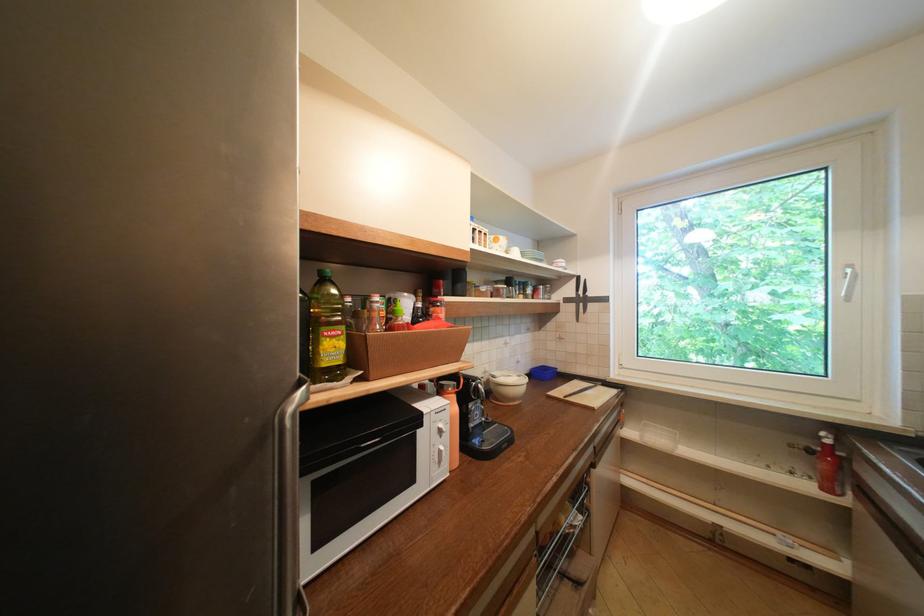
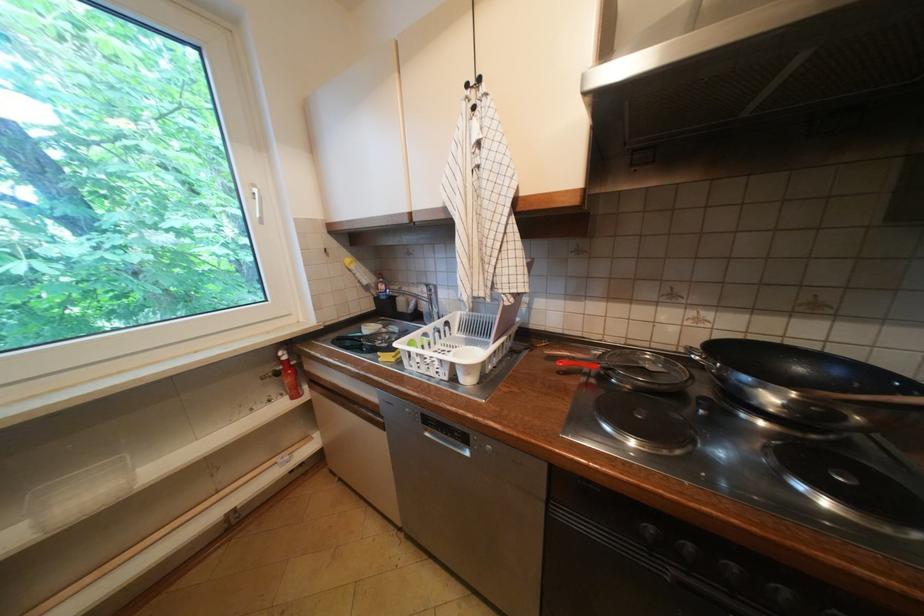
Looking at this image, based on the continuous images, in which direction is the camera rotating?

The camera rotated toward right-down.